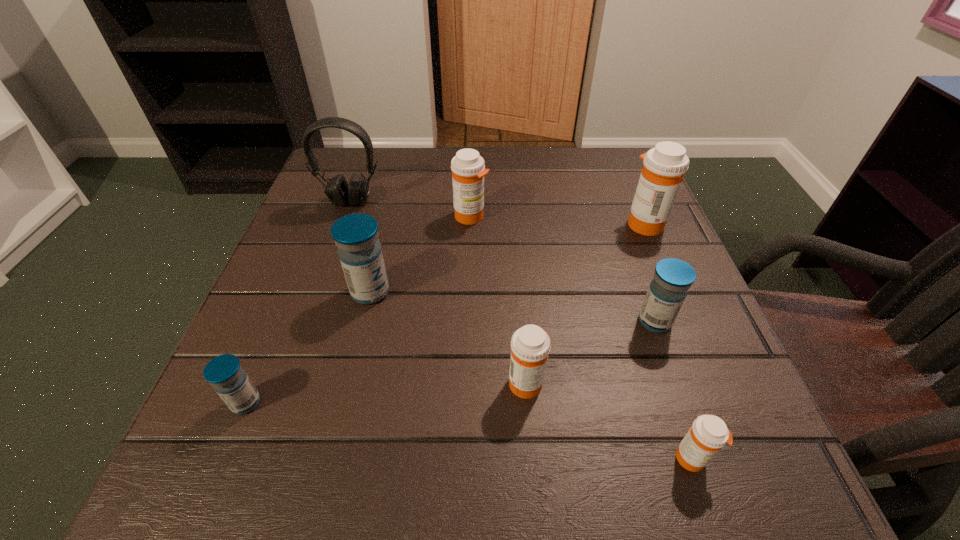
I want to click on object that can be found as the second closest to the third orange medicine from left to right, so click(667, 291).

The width and height of the screenshot is (960, 540). Identify the location of object that is the third closest one to the headset. (225, 373).

Identify which medicine is the fifth nearest to the leftmost orange medicine. Please provide its 2D coordinates. Your answer should be formatted as a tuple, i.e. [(x, y)], where the tuple contains the x and y coordinates of a point satisfying the conditions above.

[(225, 373)]

You are a GUI agent. You are given a task and a screenshot of the screen. Output one action in this format:
    pyautogui.click(x=<x>, y=<y>)
    Task: Click on the medicine that stands as the third closest to the headset
    
    Given the screenshot: What is the action you would take?
    pyautogui.click(x=225, y=373)

Identify which orange medicine is the second closest to the rightmost orange medicine. Please provide its 2D coordinates. Your answer should be formatted as a tuple, i.e. [(x, y)], where the tuple contains the x and y coordinates of a point satisfying the conditions above.

[(530, 345)]

Identify which orange medicine is located as the nearest to the headset. Please provide its 2D coordinates. Your answer should be formatted as a tuple, i.e. [(x, y)], where the tuple contains the x and y coordinates of a point satisfying the conditions above.

[(468, 169)]

Choose which blue medicine is the nearest neighbor to the nearest orange medicine. Please provide its 2D coordinates. Your answer should be formatted as a tuple, i.e. [(x, y)], where the tuple contains the x and y coordinates of a point satisfying the conditions above.

[(667, 291)]

Select which blue medicine is the third closest to the nearest object. Please provide its 2D coordinates. Your answer should be formatted as a tuple, i.e. [(x, y)], where the tuple contains the x and y coordinates of a point satisfying the conditions above.

[(225, 373)]

Locate an element on the screen. Image resolution: width=960 pixels, height=540 pixels. vacant area that satisfies the following two spatial constraints: 1. on the front-facing side of the headset; 2. on the right side of the biggest orange medicine is located at coordinates (344, 223).

Where is `vacant space that satisfies the following two spatial constraints: 1. on the front side of the fourth object from right to left; 2. on the right side of the fourth object from left to right`? This screenshot has width=960, height=540. vacant space that satisfies the following two spatial constraints: 1. on the front side of the fourth object from right to left; 2. on the right side of the fourth object from left to right is located at coordinates (467, 382).